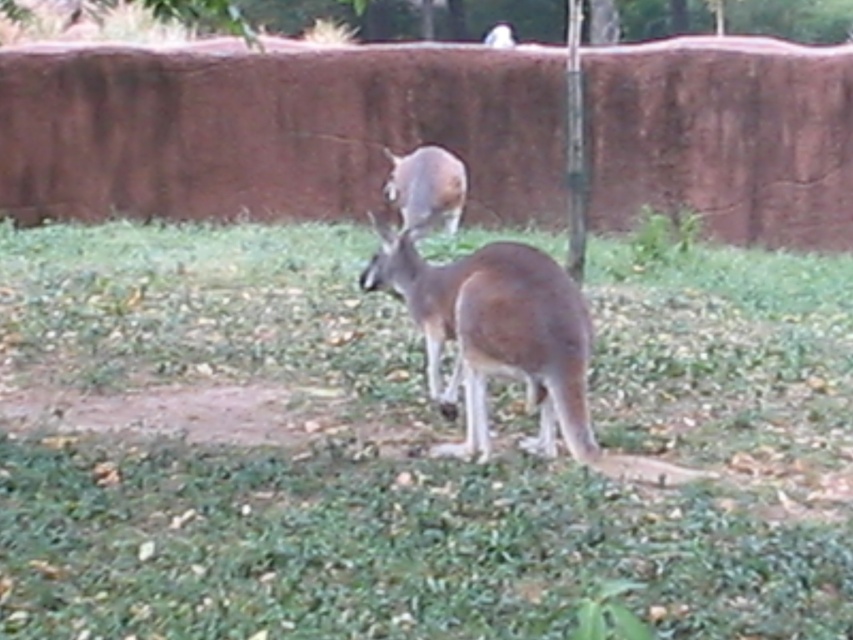
Question: Does green grassy at center appear over brown furry kangaroo at center?

Choices:
 (A) yes
 (B) no

Answer: (B)

Question: Which object is positioned closest to the green leafy tree at upper center?

Choices:
 (A) brown fur kangaroo at center
 (B) brown furry kangaroo at center
 (C) green grassy at center

Answer: (A)

Question: Among these objects, which one is farthest from the camera?

Choices:
 (A) brown furry kangaroo at center
 (B) green leafy tree at upper center
 (C) brown fur kangaroo at center

Answer: (B)

Question: Is green grassy at center positioned behind brown furry kangaroo at center?

Choices:
 (A) no
 (B) yes

Answer: (A)

Question: Which object appears farthest from the camera in this image?

Choices:
 (A) green leafy tree at upper center
 (B) green grassy at center
 (C) brown furry kangaroo at center
 (D) brown fur kangaroo at center

Answer: (A)

Question: Observing the image, what is the correct spatial positioning of green grassy at center in reference to brown fur kangaroo at center?

Choices:
 (A) left
 (B) right

Answer: (B)